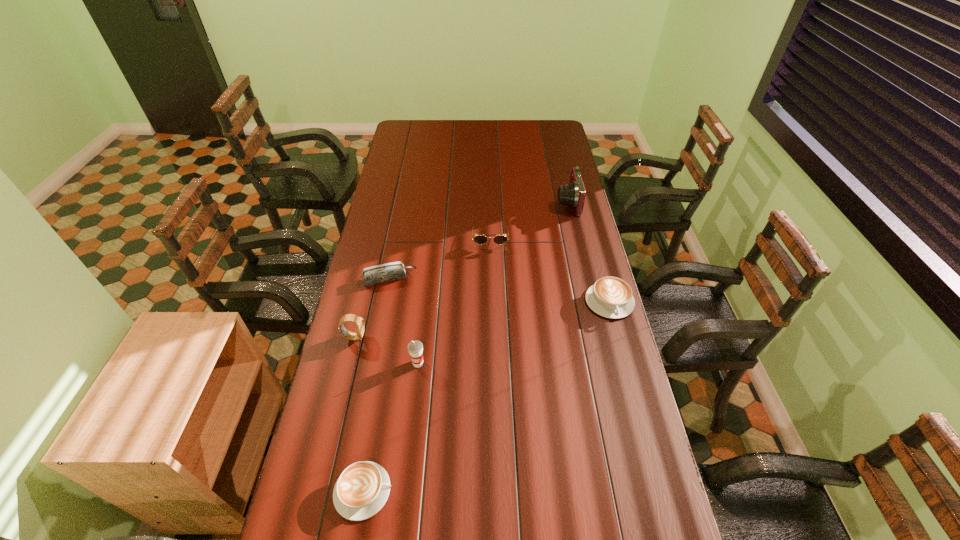
Where is `the nearest object`? Image resolution: width=960 pixels, height=540 pixels. the nearest object is located at coordinates (362, 489).

This screenshot has height=540, width=960. I want to click on the nearer cappuccino, so click(x=362, y=489).

At what (x,y) coordinates should I click in order to perform the action: click on the farther cappuccino. Please return your answer as a coordinate pair (x, y). The width and height of the screenshot is (960, 540). Looking at the image, I should click on (611, 297).

Where is `the right cappuccino`? the right cappuccino is located at coordinates (611, 297).

Identify the location of the sixth nearest object. The width and height of the screenshot is (960, 540). (478, 239).

You are a GUI agent. You are given a task and a screenshot of the screen. Output one action in this format:
    pyautogui.click(x=<x>, y=<y>)
    Task: Click on the third object from right to left
    This screenshot has width=960, height=540.
    Given the screenshot: What is the action you would take?
    pyautogui.click(x=478, y=239)

Where is `pencil box`? This screenshot has width=960, height=540. pencil box is located at coordinates (387, 272).

This screenshot has width=960, height=540. I want to click on watch, so click(359, 321).

Where is `the fifth shortest object`? the fifth shortest object is located at coordinates (359, 321).

At what (x,y) coordinates should I click in order to perform the action: click on camera. Please return your answer as a coordinate pair (x, y). The width and height of the screenshot is (960, 540). Looking at the image, I should click on (573, 194).